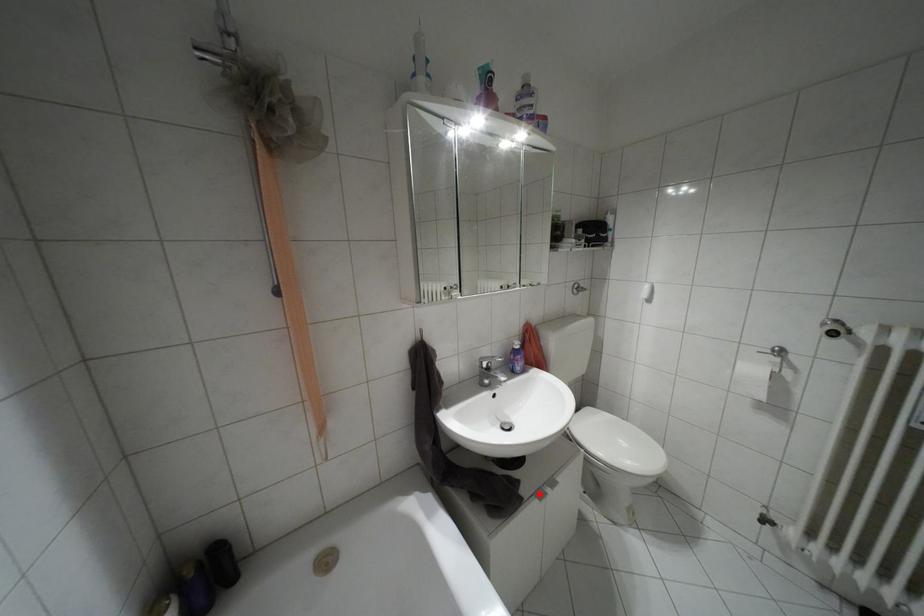
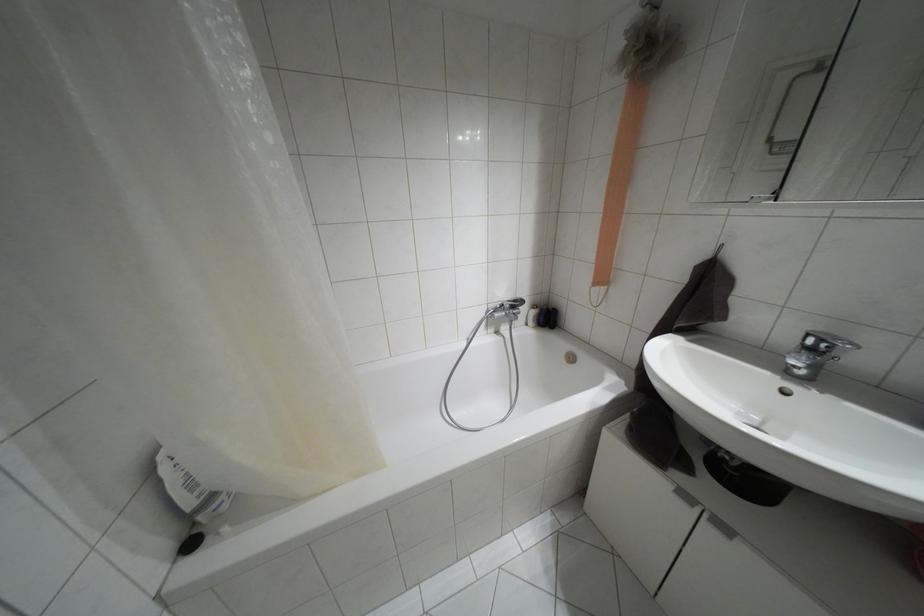
Locate, in the second image, the point that corresponds to the highlighted location in the first image.

(685, 496)